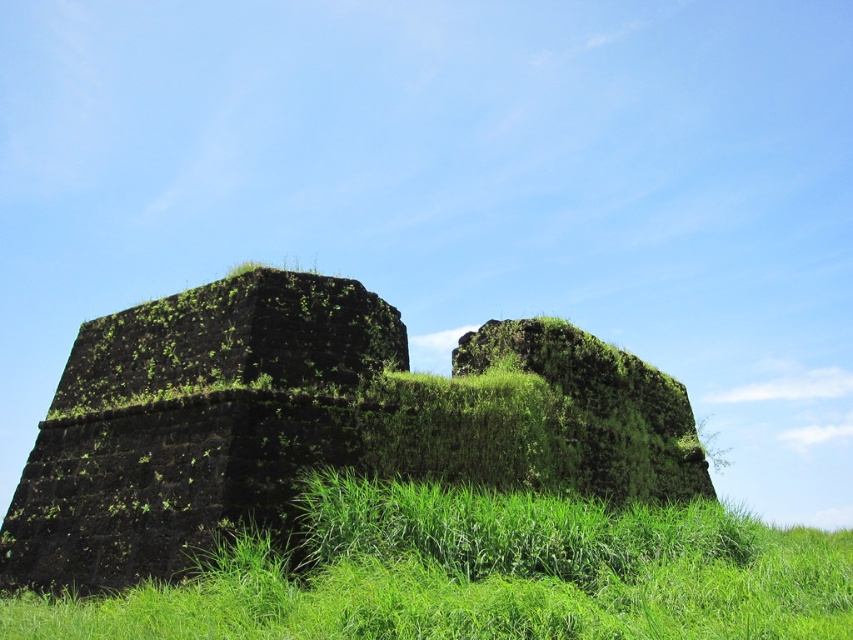
Question: Observing the image, what is the correct spatial positioning of green mossy stone wall at center in reference to green grassy at lower center?

Choices:
 (A) right
 (B) left

Answer: (B)

Question: Is green mossy stone wall at center to the left of green grassy at lower center from the viewer's perspective?

Choices:
 (A) no
 (B) yes

Answer: (B)

Question: Can you confirm if green mossy stone wall at center is wider than green grassy at lower center?

Choices:
 (A) no
 (B) yes

Answer: (B)

Question: Which object is closer to the camera taking this photo?

Choices:
 (A) green mossy stone wall at center
 (B) green grassy at lower center

Answer: (B)

Question: Which of the following is the closest to the observer?

Choices:
 (A) green grassy at lower center
 (B) green mossy stone wall at center

Answer: (A)